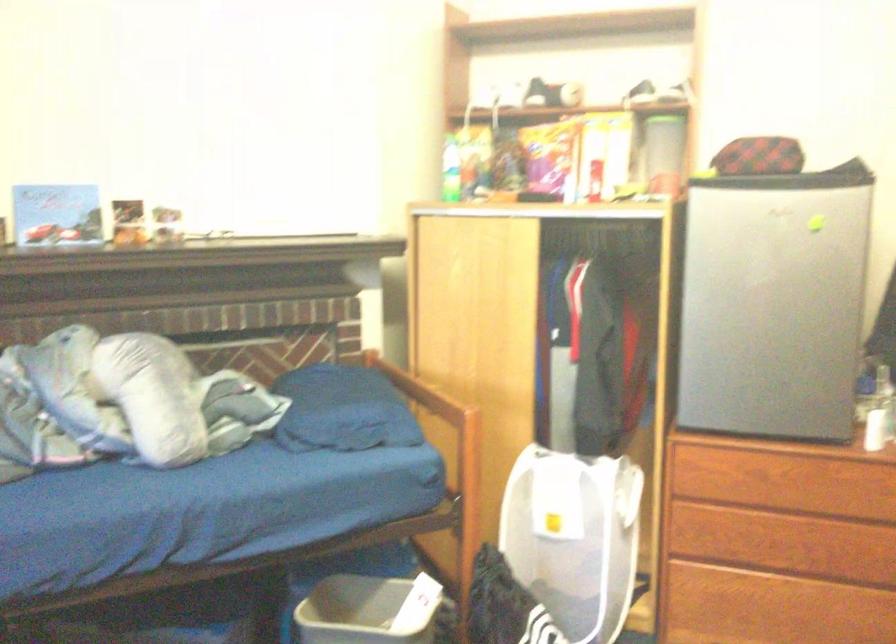
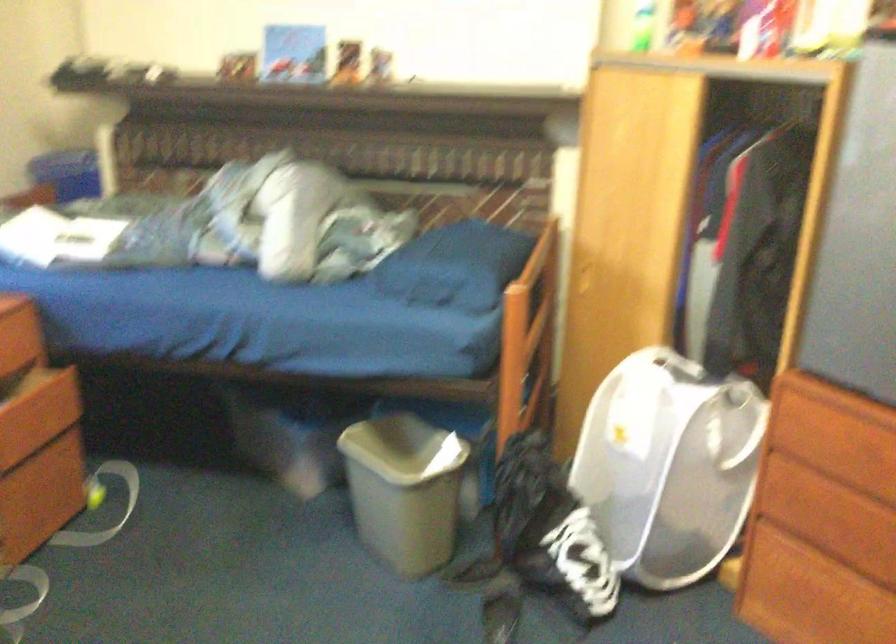
Find the pixel in the second image that matches point 254,357 in the first image.

(446, 205)